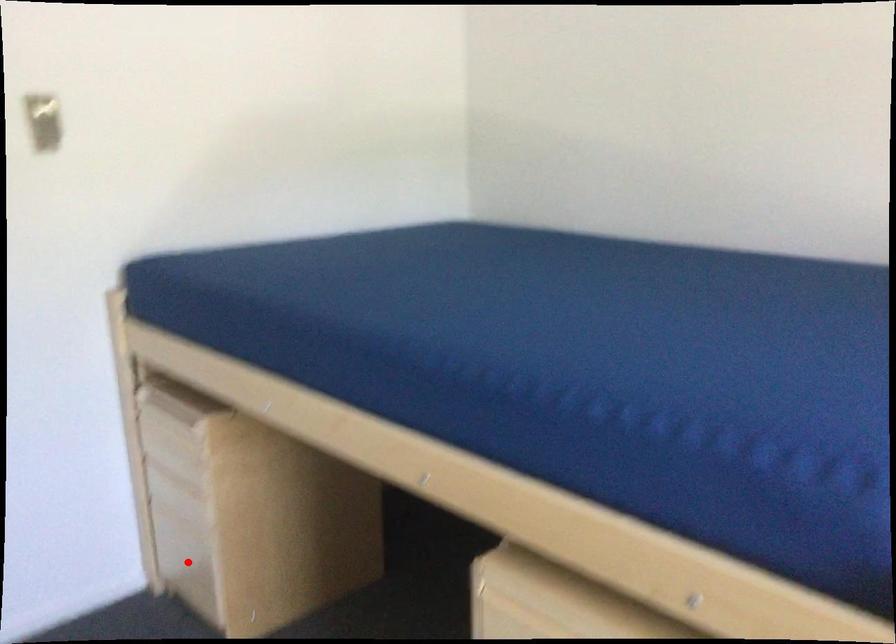
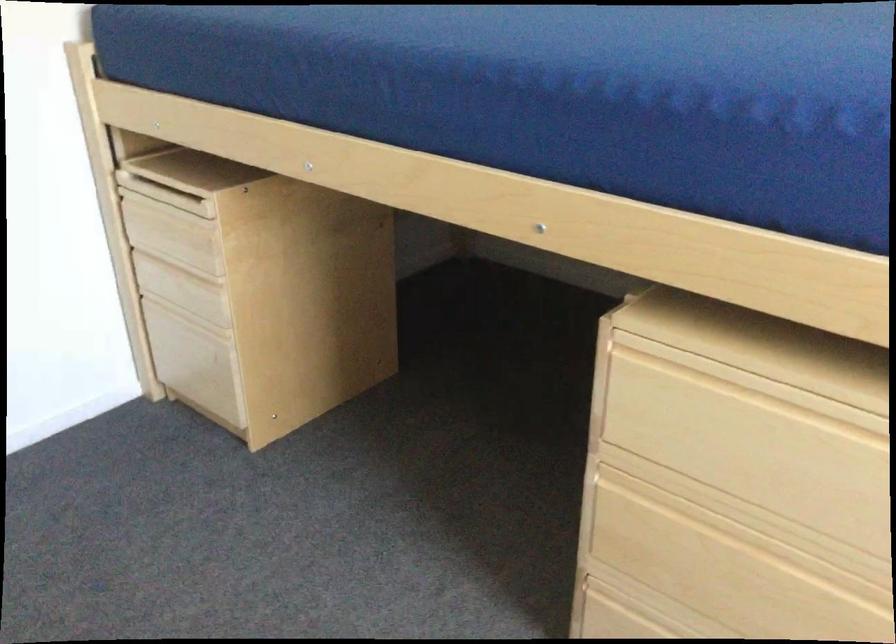
Question: I am providing you with two images of the same scene from different viewpoints. Given a red point in image1, look at the same physical point in image2. Is it:

Choices:
 (A) Closer to the viewpoint
 (B) Farther from the viewpoint

Answer: (A)